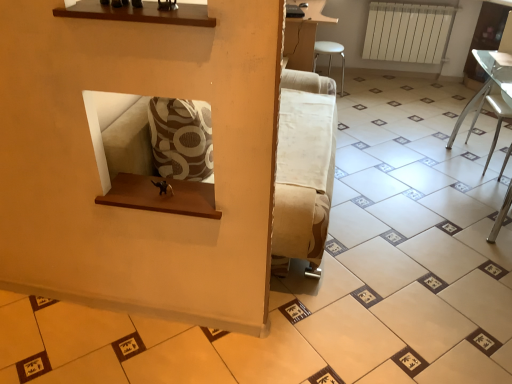
The width and height of the screenshot is (512, 384). I want to click on free region under clear glass table at right, which is the 1th furniture in right-to-left order (from a real-world perspective), so click(x=490, y=200).